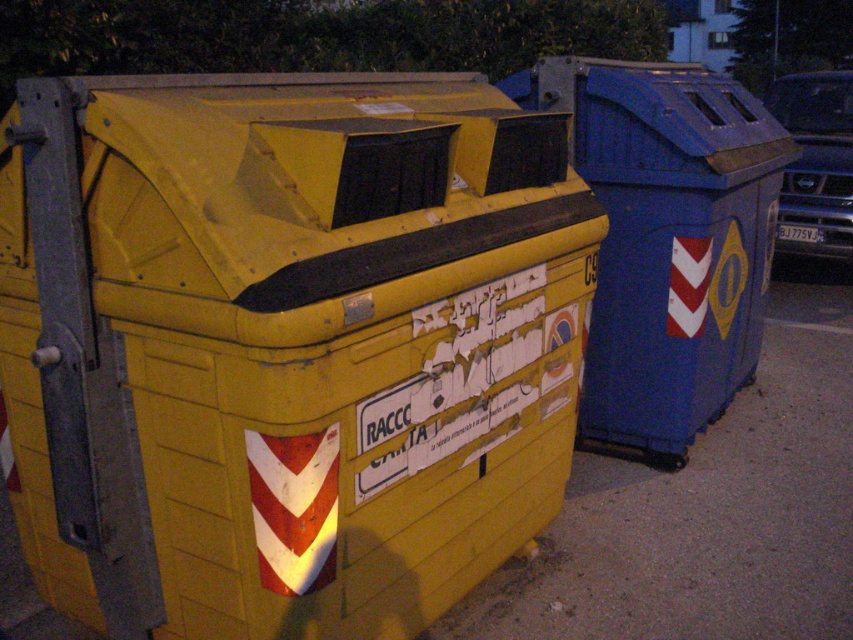
Can you confirm if yellow matte plastic recycling bin at left is thinner than blue plastic recycling bin at right?

No, yellow matte plastic recycling bin at left is not thinner than blue plastic recycling bin at right.

From the picture: Who is more distant from viewer, (376,168) or (712,214)?

Positioned behind is point (712,214).

Locate an element on the screen. yellow matte plastic recycling bin at left is located at coordinates (283, 344).